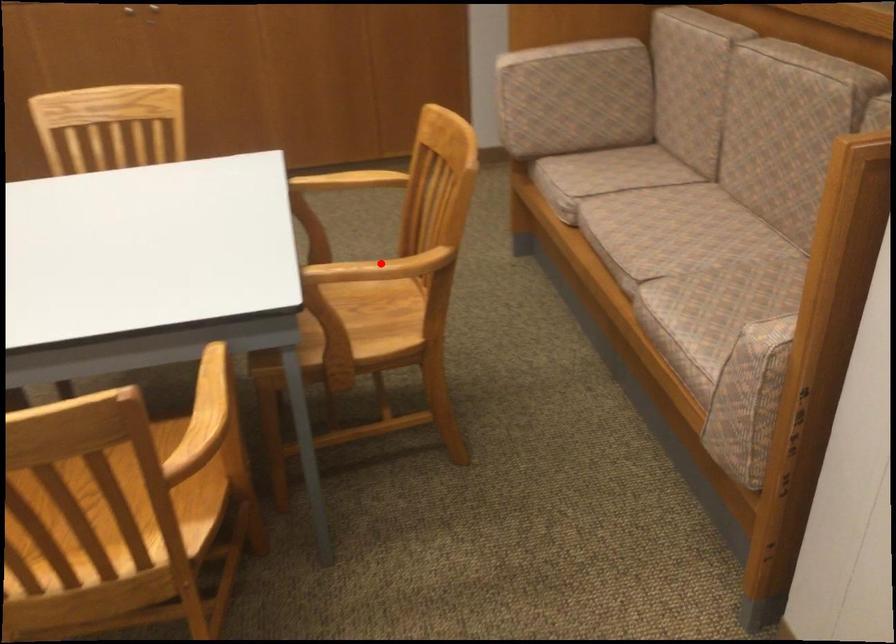
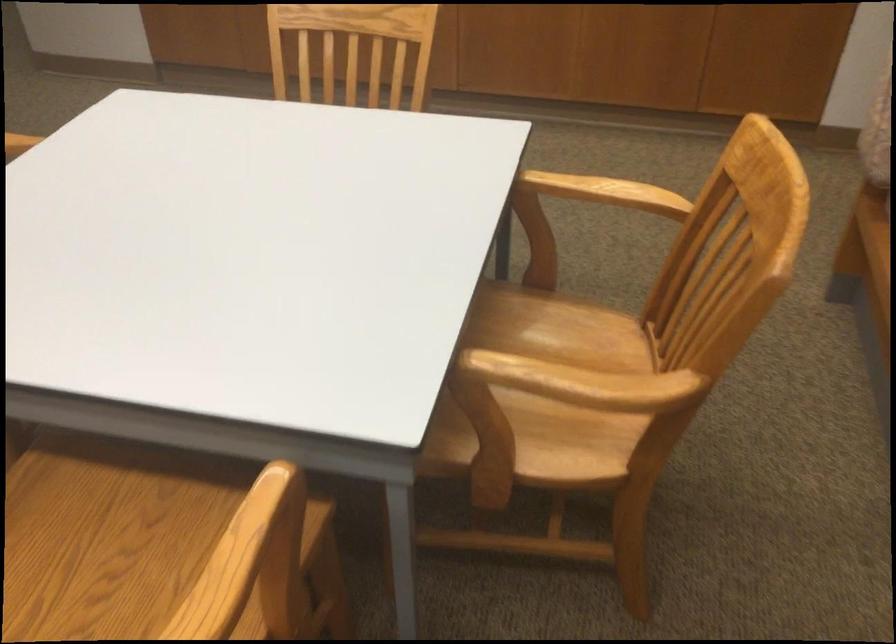
Question: A red point is marked in image1. In image2, is the corresponding 3D point closer to the camera or farther? Reply with the corresponding letter.

Choices:
 (A) The corresponding 3D point is closer.
 (B) The corresponding 3D point is farther.

Answer: (A)